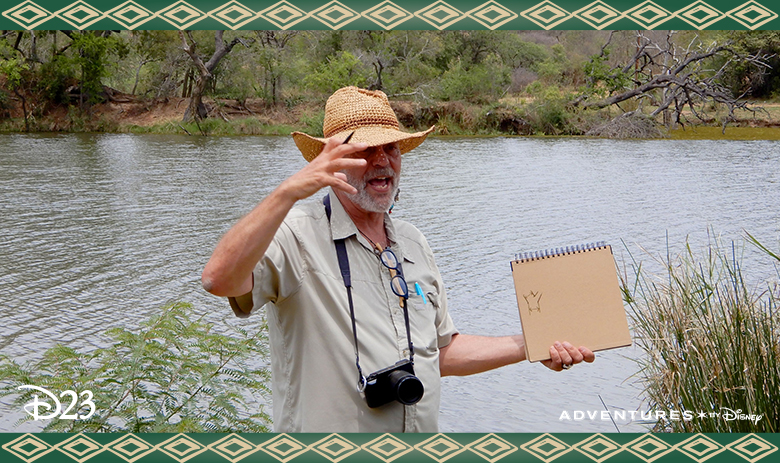
Locate an element on the screen. notepad is located at coordinates (583, 306).